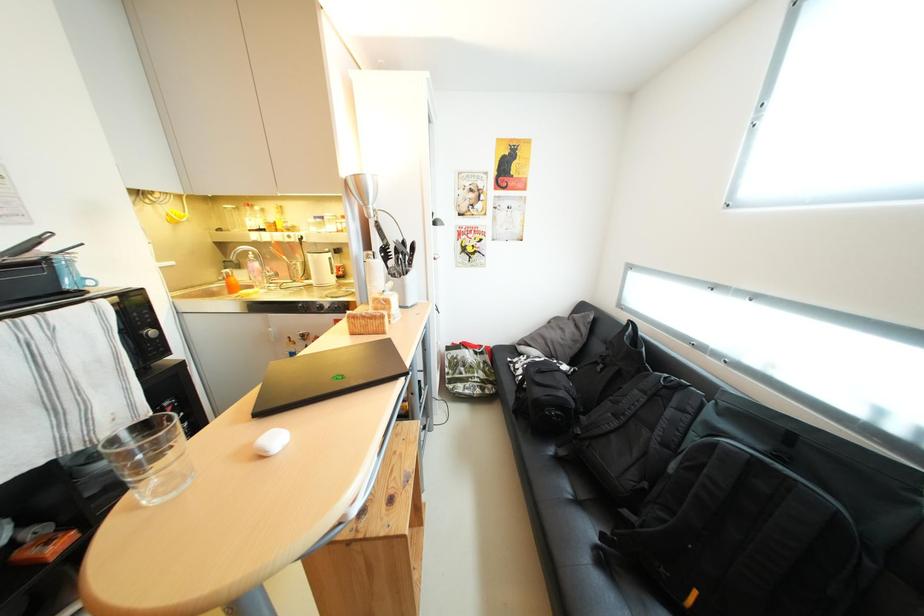
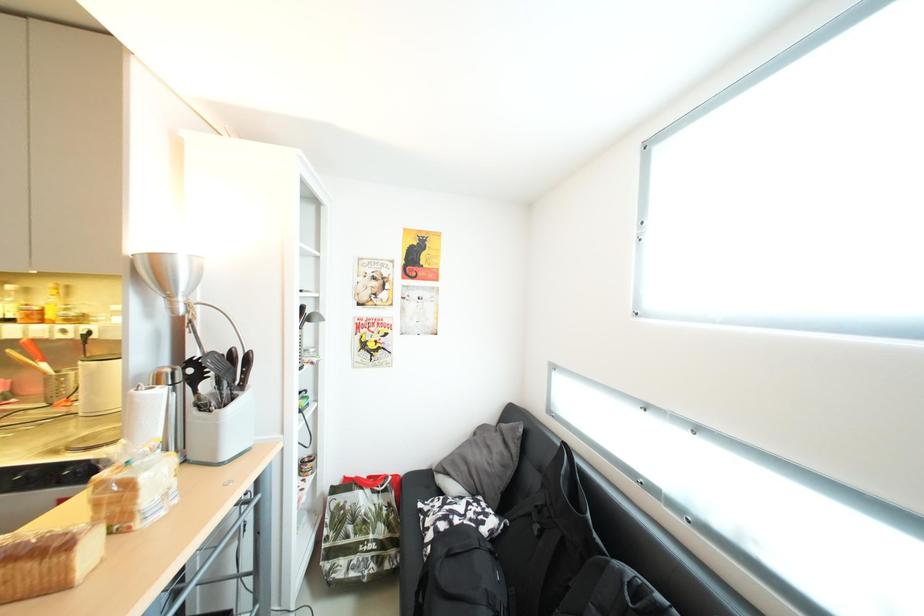
In a continuous first-person perspective shot, in which direction is the camera moving?

The cameraman walked toward right, forward.